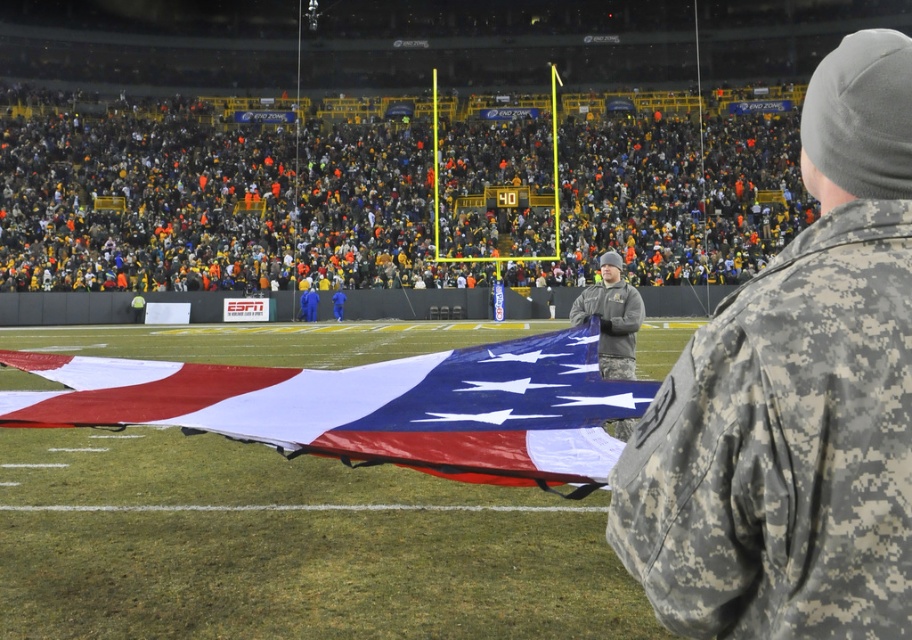
Does camouflage fabric uniform at right appear over camouflage fabric uniform at center?

Correct, camouflage fabric uniform at right is located above camouflage fabric uniform at center.

Can you confirm if camouflage fabric uniform at right is bigger than camouflage fabric uniform at center?

No.

Locate an element on the screen. The image size is (912, 640). camouflage fabric uniform at right is located at coordinates (784, 448).

Does camouflage fabric uniform at right have a lesser width compared to polyester american flag at center?

Indeed, camouflage fabric uniform at right has a lesser width compared to polyester american flag at center.

Is camouflage fabric uniform at right in front of polyester american flag at center?

Yes, camouflage fabric uniform at right is closer to the viewer.

Image resolution: width=912 pixels, height=640 pixels. What are the coordinates of `camouflage fabric uniform at right` in the screenshot? It's located at (784, 448).

Find the location of a particular element. The height and width of the screenshot is (640, 912). camouflage fabric uniform at right is located at coordinates (784, 448).

Between camouflage uniform at center and polyester american flag at center, which one appears on the right side from the viewer's perspective?

From the viewer's perspective, polyester american flag at center appears more on the right side.

Who is positioned more to the left, camouflage uniform at center or polyester american flag at center?

camouflage uniform at center is more to the left.

This screenshot has width=912, height=640. I want to click on camouflage uniform at center, so 206,202.